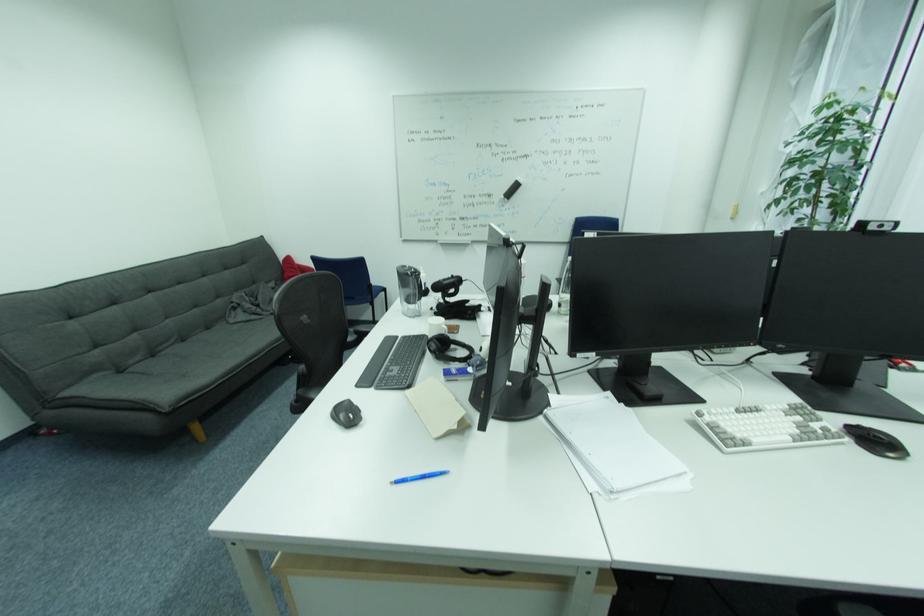
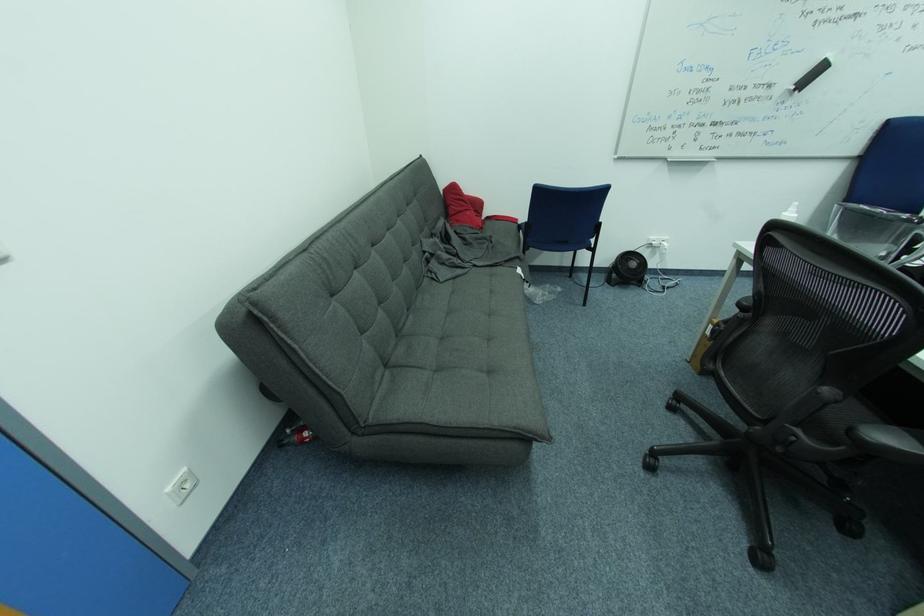
Locate, in the second image, the point that corresponds to point (190, 342) in the first image.

(415, 312)